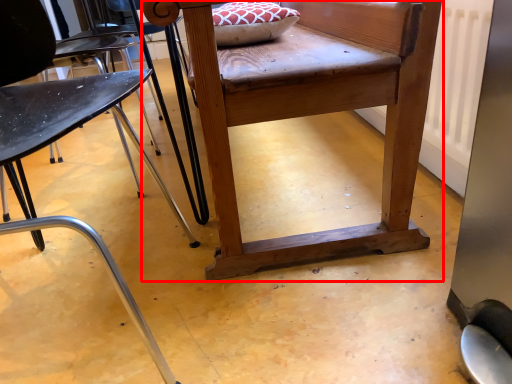
Question: Considering the relative positions of table (annotated by the red box) and chair in the image provided, where is table (annotated by the red box) located with respect to the staircase?

Choices:
 (A) left
 (B) right

Answer: (B)